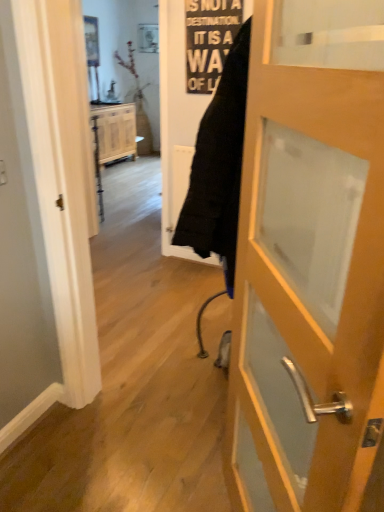
Question: From a real-world perspective, is wooden cabinet at center located higher than black paper sign at upper center?

Choices:
 (A) no
 (B) yes

Answer: (A)

Question: Is wooden cabinet at center at the right side of black paper sign at upper center?

Choices:
 (A) no
 (B) yes

Answer: (A)

Question: Is wooden cabinet at center located outside black paper sign at upper center?

Choices:
 (A) yes
 (B) no

Answer: (A)

Question: Is wooden cabinet at center looking in the opposite direction of black paper sign at upper center?

Choices:
 (A) no
 (B) yes

Answer: (A)

Question: Is wooden cabinet at center not close to black paper sign at upper center?

Choices:
 (A) yes
 (B) no

Answer: (A)

Question: Is point (193, 75) closer or farther from the camera than point (114, 148)?

Choices:
 (A) farther
 (B) closer

Answer: (B)

Question: Is black paper sign at upper center taller or shorter than wooden cabinet at center?

Choices:
 (A) tall
 (B) short

Answer: (B)

Question: Is black paper sign at upper center bigger or smaller than wooden cabinet at center?

Choices:
 (A) big
 (B) small

Answer: (B)

Question: From the image's perspective, relative to wooden cabinet at center, is black paper sign at upper center above or below?

Choices:
 (A) below
 (B) above

Answer: (A)

Question: From the image's perspective, is wooden door at center above or below wooden cabinet at center?

Choices:
 (A) below
 (B) above

Answer: (A)

Question: From a real-world perspective, is wooden door at center positioned above or below wooden cabinet at center?

Choices:
 (A) above
 (B) below

Answer: (A)

Question: Based on their sizes in the image, would you say wooden door at center is bigger or smaller than wooden cabinet at center?

Choices:
 (A) big
 (B) small

Answer: (B)

Question: Looking at their shapes, would you say wooden door at center is wider or thinner than wooden cabinet at center?

Choices:
 (A) thin
 (B) wide

Answer: (A)

Question: In terms of height, does black paper sign at upper center look taller or shorter compared to wooden door at center?

Choices:
 (A) short
 (B) tall

Answer: (A)

Question: Looking at their shapes, would you say black paper sign at upper center is wider or thinner than wooden door at center?

Choices:
 (A) wide
 (B) thin

Answer: (B)